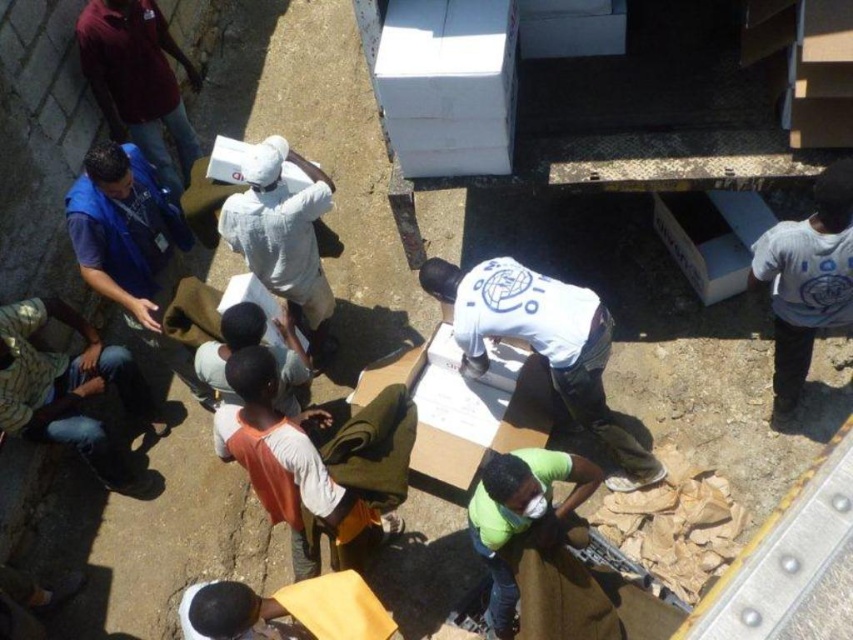
Describe the element at coordinates (317, 461) in the screenshot. I see `orange fabric bag at center` at that location.

Locate an element on the screen. Image resolution: width=853 pixels, height=640 pixels. orange fabric bag at center is located at coordinates (317, 461).

Between point (222, 408) and point (601, 346), which one is positioned behind?

Point (601, 346)

This screenshot has height=640, width=853. I want to click on orange fabric bag at center, so click(x=317, y=461).

Is camouflage fabric shirt at lower left positioned in front of blue fabric shirt at upper left?

That is True.

Does camouflage fabric shirt at lower left have a lesser width compared to blue fabric shirt at upper left?

No.

Does point (1, 321) come in front of point (140, 115)?

That is True.

Find the location of a particular element. This screenshot has height=640, width=853. camouflage fabric shirt at lower left is located at coordinates (68, 388).

Who is taller, orange fabric bag at center or camouflage fabric shirt at lower left?

With more height is orange fabric bag at center.

The image size is (853, 640). In order to click on orange fabric bag at center in this screenshot , I will do `click(317, 461)`.